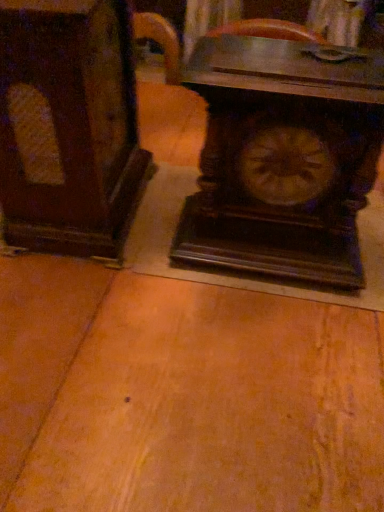
Identify the location of vacant space to the left of wooden carved clock at center. The width and height of the screenshot is (384, 512). (x=146, y=264).